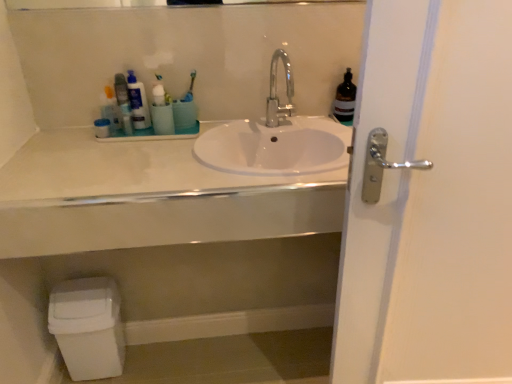
The width and height of the screenshot is (512, 384). I want to click on free space on the front side of translucent plastic bottle at upper left, which is counted as the third toiletry, starting from the left, so click(129, 145).